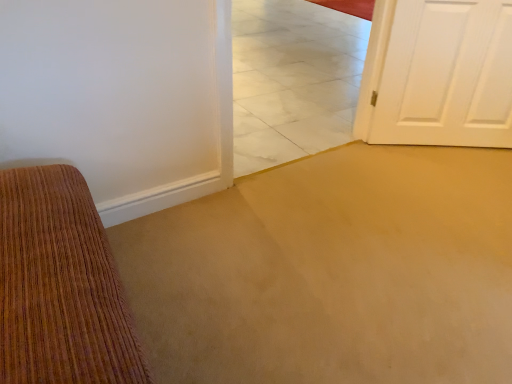
Find the location of a particular element. Image resolution: width=512 pixels, height=384 pixels. space that is in front of white painted wood door at right is located at coordinates (451, 178).